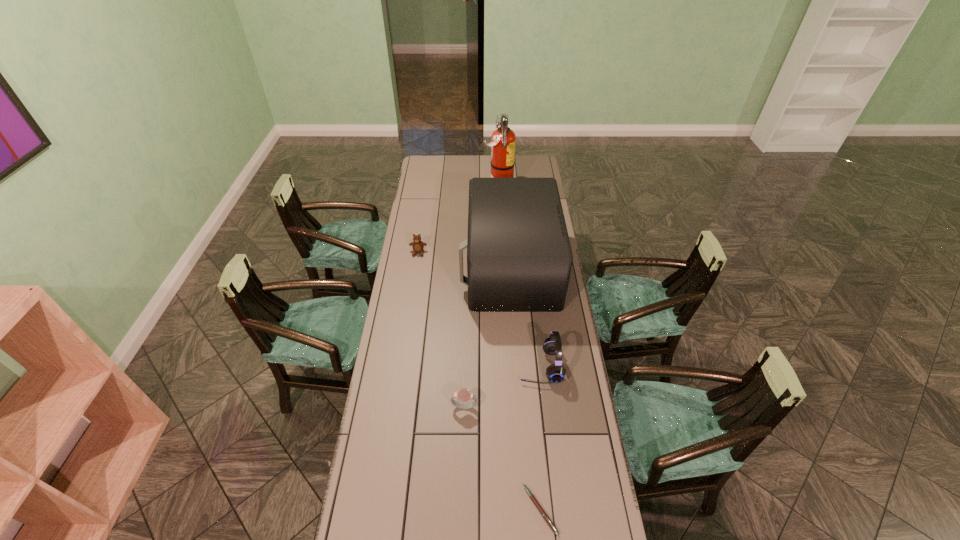
Where is `free space located 0.330m at the face of the fourth tallest object`? Image resolution: width=960 pixels, height=540 pixels. free space located 0.330m at the face of the fourth tallest object is located at coordinates (410, 309).

Find the location of `free space located on the right of the watch`. free space located on the right of the watch is located at coordinates [x=544, y=407].

Where is `free location located at the nib of the nearest object`? This screenshot has width=960, height=540. free location located at the nib of the nearest object is located at coordinates (445, 510).

Identify the location of free region located 0.380m at the nib of the nearest object. (398, 510).

The image size is (960, 540). What are the coordinates of `vacant area situated at the nib of the nearest object` in the screenshot? It's located at (489, 510).

Find the location of `object present at the left edge`. object present at the left edge is located at coordinates (418, 246).

The image size is (960, 540). In order to click on microwave oven that is at the right edge in this screenshot , I will do pyautogui.click(x=519, y=258).

This screenshot has width=960, height=540. Find the location of `headset that is positioned at the right edge`. headset that is positioned at the right edge is located at coordinates (555, 373).

The width and height of the screenshot is (960, 540). I want to click on pen positioned at the right edge, so click(544, 514).

In the image, there is a desktop. Identify the location of free space at the far edge. Image resolution: width=960 pixels, height=540 pixels. (485, 176).